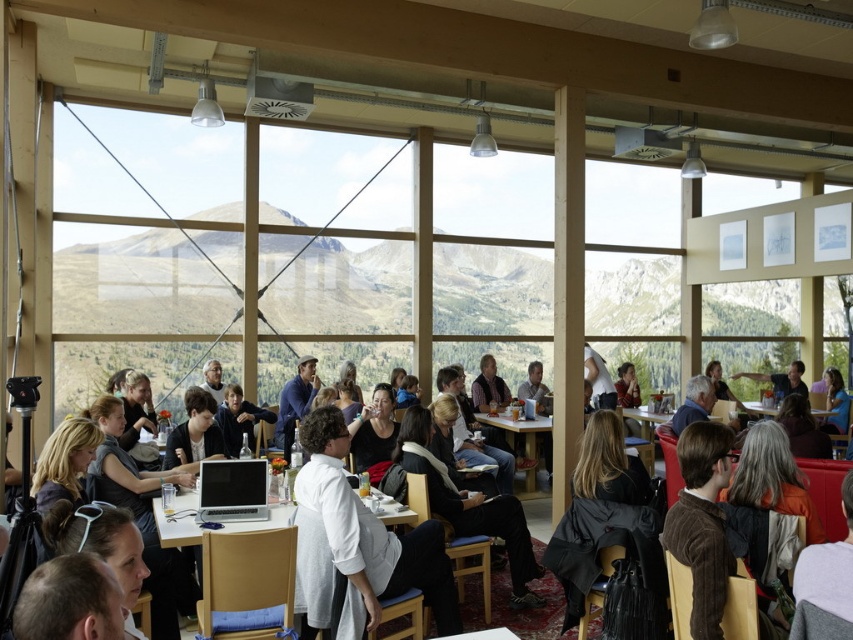
Can you confirm if white matte sweater at center is taller than white plastic table at center?

Indeed, white matte sweater at center has a greater height compared to white plastic table at center.

Does white matte sweater at center appear on the right side of white plastic table at center?

Incorrect, white matte sweater at center is not on the right side of white plastic table at center.

Does point (389, 589) come closer to viewer compared to point (746, 404)?

Yes, it is.

Find the location of a particular element. The image size is (853, 640). white matte sweater at center is located at coordinates (370, 531).

In the scene shown: Does dark brown leather jacket at lower right have a lesser width compared to white plastic table at center?

In fact, dark brown leather jacket at lower right might be wider than white plastic table at center.

Who is lower down, dark brown leather jacket at lower right or white plastic table at center?

Positioned lower is white plastic table at center.

Between point (793, 376) and point (820, 416), which one is positioned behind?

Point (793, 376)

You are a GUI agent. You are given a task and a screenshot of the screen. Output one action in this format:
    pyautogui.click(x=<x>, y=<y>)
    Task: Click on the dark brown leather jacket at lower right
    This screenshot has width=853, height=640.
    Given the screenshot: What is the action you would take?
    pyautogui.click(x=780, y=380)

Between white shirt at center and white glossy table at center, which one appears on the right side from the viewer's perspective?

white shirt at center

Who is more distant from viewer, (838,474) or (287,502)?

Positioned behind is point (838,474).

Who is more forward, (820, 504) or (200, 618)?

Positioned in front is point (200, 618).

At what (x,y) coordinates should I click in order to perform the action: click on white shirt at center. Please return your answer as a coordinate pair (x, y). Looking at the image, I should click on (529, 611).